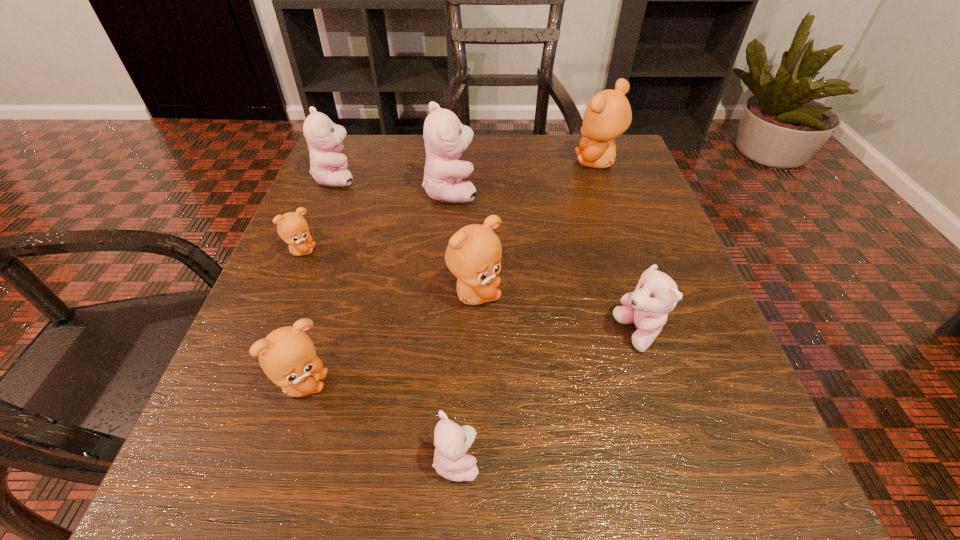
Where is `vacant space at the near edge`? This screenshot has height=540, width=960. vacant space at the near edge is located at coordinates (562, 449).

Identify the location of vacant position at the left edge of the desktop. This screenshot has height=540, width=960. (266, 309).

What are the coordinates of `vacant space at the right edge of the desktop` in the screenshot? It's located at (648, 406).

At what (x,y) coordinates should I click in order to perform the action: click on free area in between the second nearest teddy bear and the nearest teddy bear. Please return your answer as a coordinate pair (x, y). Looking at the image, I should click on (379, 422).

Locate an element on the screen. Image resolution: width=960 pixels, height=540 pixels. empty space between the second farthest brown teddy bear and the second brown teddy bear from right to left is located at coordinates (388, 273).

Find the location of a particular element. The image size is (960, 540). free space that is in between the third smallest pink teddy bear and the second nearest brown teddy bear is located at coordinates (405, 236).

Where is `empty space between the nearest brown teddy bear and the second brown teddy bear from right to left`? empty space between the nearest brown teddy bear and the second brown teddy bear from right to left is located at coordinates (389, 340).

Identify the location of free space that is in between the leftmost brown teddy bear and the third brown teddy bear from right to left. (302, 318).

You are a GUI agent. You are given a task and a screenshot of the screen. Output one action in this format:
    pyautogui.click(x=<x>, y=<y>)
    Task: Click on the vacant space that's between the farthest brown teddy bear and the leftmost brown teddy bear
    
    Given the screenshot: What is the action you would take?
    pyautogui.click(x=449, y=207)

Identify the location of free space between the biggest pink teddy bear and the biggest brown teddy bear. This screenshot has height=540, width=960. (524, 177).